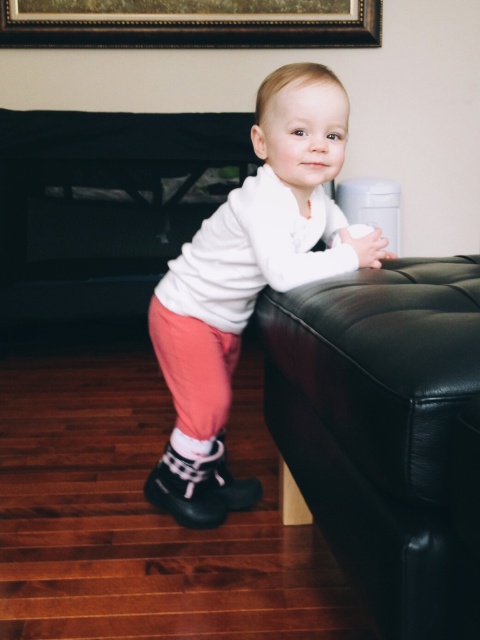
You are a photographer setting up a shoot in this room. You need to place a small prop between the black leather ottoman at right and the white soft sweater at center. Based on their positions, which object should the prop be closer to?

The prop should be placed closer to the white soft sweater at center since the black leather ottoman at right is positioned to the right of the white soft sweater at center, meaning the sweater is closer to the center of the room and the ottoman is further to the right.

You are a furniture designer evaluating the placement of the black leather ottoman at right and the white soft sweater at center in a living room. Based on their heights, which object would you need to adjust to ensure the sweater is not hidden behind the ottoman?

The black leather ottoman at right is shorter than the white soft sweater at center. To prevent the sweater from being hidden, the ottoman should be raised or replaced with a taller one so that it can block the view of the sweater if needed.